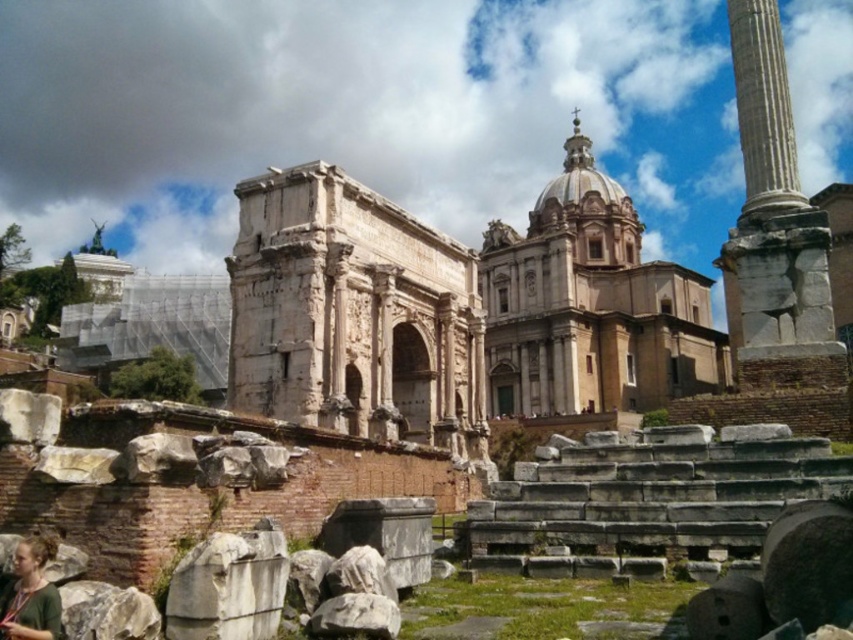
Who is shorter, light brown stone church at center or green fabric shirt at lower left?

green fabric shirt at lower left is shorter.

Is point (570, 378) positioned before point (51, 545)?

No, (570, 378) is behind (51, 545).

This screenshot has width=853, height=640. I want to click on light brown stone church at center, so click(x=456, y=310).

Can you confirm if white marble column at right is taller than green fabric shirt at lower left?

Correct, white marble column at right is much taller as green fabric shirt at lower left.

Who is positioned more to the right, white marble column at right or green fabric shirt at lower left?

white marble column at right

I want to click on white marble column at right, so click(x=775, y=205).

Can you confirm if light brown stone church at center is shorter than white marble column at right?

Incorrect, light brown stone church at center's height does not fall short of white marble column at right's.

Is light brown stone church at center to the right of white marble column at right from the viewer's perspective?

No, light brown stone church at center is not to the right of white marble column at right.

You are a GUI agent. You are given a task and a screenshot of the screen. Output one action in this format:
    pyautogui.click(x=<x>, y=<y>)
    Task: Click on the light brown stone church at center
    The image size is (853, 640).
    Given the screenshot: What is the action you would take?
    pyautogui.click(x=456, y=310)

This screenshot has width=853, height=640. I want to click on light brown stone church at center, so click(456, 310).